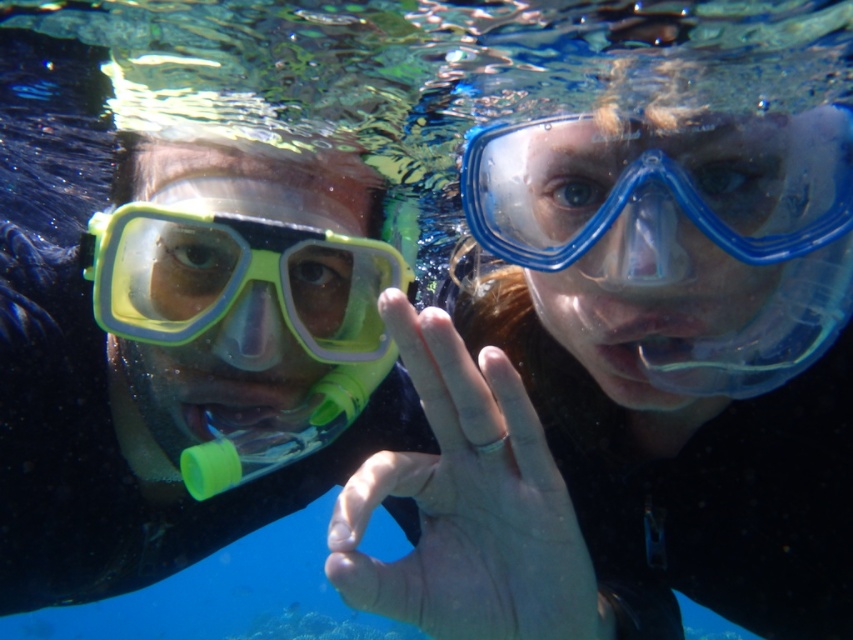
Based on the photo, does matte green snorkel mask at left have a greater height compared to clear skin hand at center?

Correct, matte green snorkel mask at left is much taller as clear skin hand at center.

What do you see at coordinates (183, 362) in the screenshot?
I see `matte green snorkel mask at left` at bounding box center [183, 362].

Between point (18, 371) and point (572, 609), which one is positioned behind?

The point (18, 371) is more distant.

This screenshot has height=640, width=853. Find the location of `matte green snorkel mask at left`. matte green snorkel mask at left is located at coordinates click(x=183, y=362).

Who is lower down, transparent blue goggles at upper right or yellow-green plastic goggles at left?

yellow-green plastic goggles at left

Is transparent blue goggles at upper right positioned before yellow-green plastic goggles at left?

That is True.

Measure the distance between point (x=511, y=246) and camera.

Point (x=511, y=246) is 90.83 centimeters away from camera.

I want to click on transparent blue goggles at upper right, so click(x=659, y=192).

Does clear skin hand at center appear on the left side of yellow-green plastic goggles at left?

No, clear skin hand at center is not to the left of yellow-green plastic goggles at left.

Where is `clear skin hand at center`? clear skin hand at center is located at coordinates (468, 506).